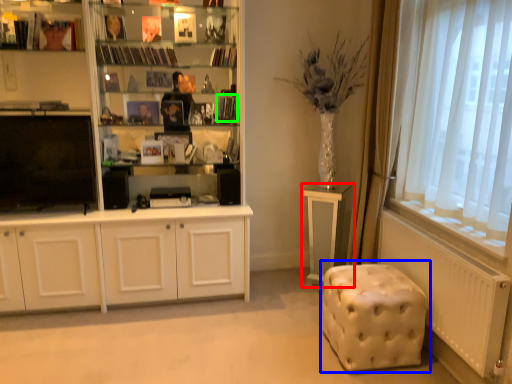
Question: Considering the real-world distances, which object is closest to table (highlighted by a red box)? music stool (highlighted by a blue box) or book (highlighted by a green box).

Choices:
 (A) music stool
 (B) book

Answer: (A)